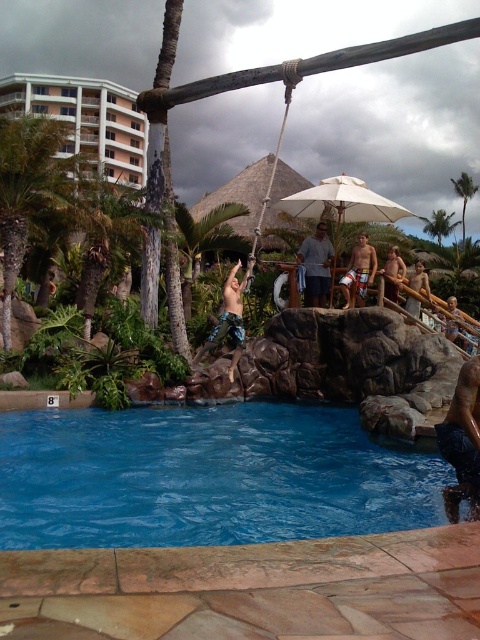
Is smooth tan skin at lower right smaller than gray fabric shirt at upper center?

Yes.

Is smooth tan skin at lower right thinner than gray fabric shirt at upper center?

Yes, smooth tan skin at lower right is thinner than gray fabric shirt at upper center.

Is point (468, 440) farther from camera compared to point (303, 257)?

No.

Identify the location of smooth tan skin at lower right. (463, 440).

Which is more to the left, gray fabric shirt at upper center or tan board shorts at upper right?

Positioned to the left is gray fabric shirt at upper center.

Does gray fabric shirt at upper center lie behind tan board shorts at upper right?

That is True.

Which is in front, point (319, 276) or point (364, 275)?

Point (364, 275) is in front.

At what (x,y) coordinates should I click in order to perform the action: click on gray fabric shirt at upper center. Please return your answer as a coordinate pair (x, y). Looking at the image, I should click on (316, 266).

Consider the image. Is white glossy building at upper left to the left of smooth tan skin at lower right from the viewer's perspective?

Correct, you'll find white glossy building at upper left to the left of smooth tan skin at lower right.

At what (x,y) coordinates should I click in order to perform the action: click on white glossy building at upper left. Please return your answer as a coordinate pair (x, y). This screenshot has height=640, width=480. Looking at the image, I should click on (85, 120).